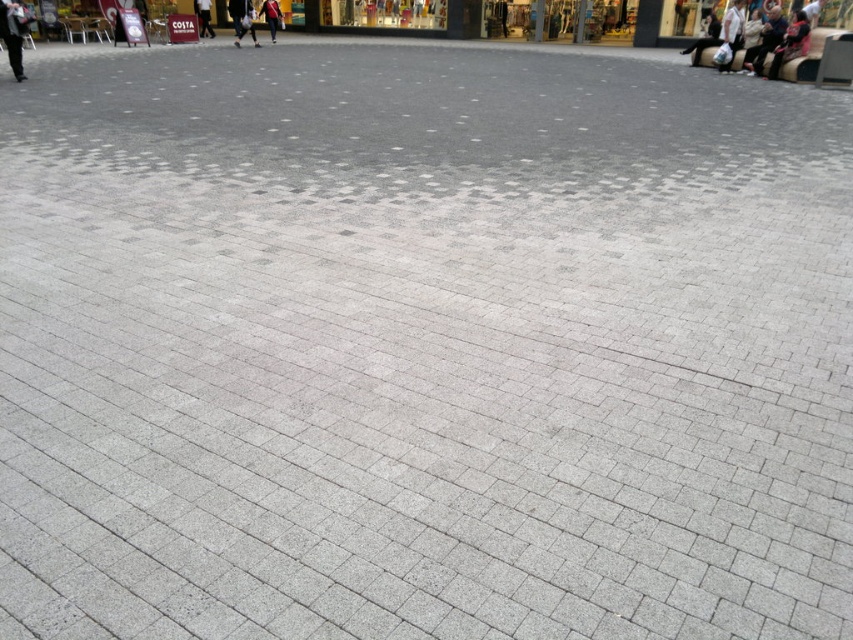
You are standing in the plaza and want to walk towards the two points marked in the image. Which point, point (13, 17) or point (207, 33), will you reach first?

You will reach point (13, 17) first because it is closer to you than point (207, 33).